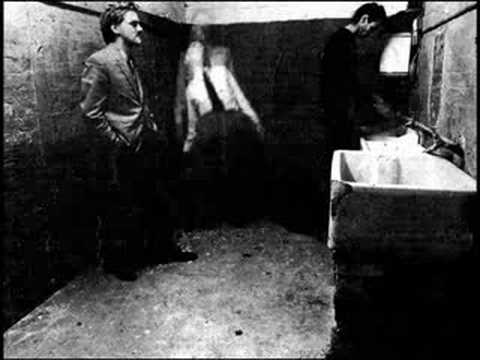
Identify the location of walls. (56, 176), (296, 85), (458, 102).